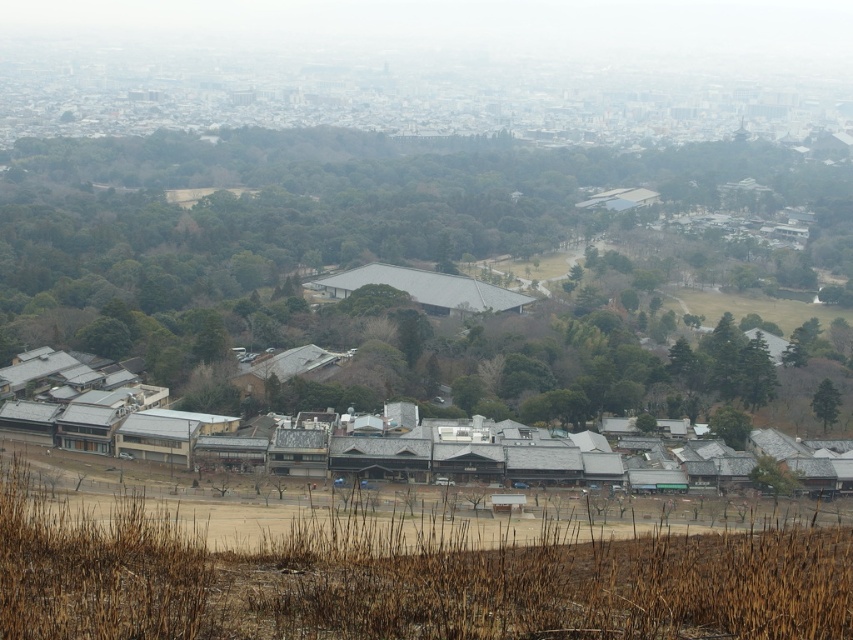
You are standing in the middle of the field with dry, brown grass and want to look at the gray concrete cityscape at upper center. In which direction should you turn your head to see it?

You should look upward because the gray concrete cityscape at upper center is located at point (405,93), which is above your current eye level.

You are an urban planner analyzing the image. You need to determine if the gray concrete cityscape at upper center can be seen in its entirety from the gray metallic building at lower center. What do you think?

The gray concrete cityscape at upper center might be wider than gray metallic building at lower center, so it is possible that parts of the gray concrete cityscape at upper center may not be fully visible from the gray metallic building at lower center due to its width.

From the picture: You are standing in the middle of the field with dry, brown grass and want to walk towards the gray metallic building at lower center. Which direction should you walk to avoid the gray concrete cityscape at upper center?

You should walk towards the gray metallic building at lower center because it is closer to you than the gray concrete cityscape at upper center, so you won